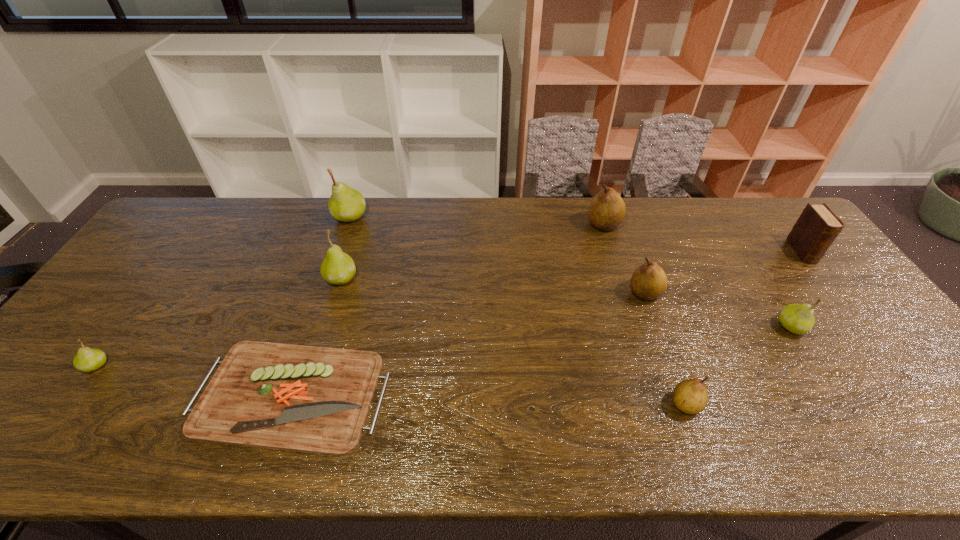
This screenshot has width=960, height=540. Identify the location of free space at the left edge of the desktop. (90, 383).

The height and width of the screenshot is (540, 960). What are the coordinates of `vacant position at the near left corner of the desktop` in the screenshot? It's located at (38, 452).

Find the location of `free region at the far right corner`. free region at the far right corner is located at coordinates 782,222.

Where is `vacant area between the tallest pear and the second farthest green pear`? vacant area between the tallest pear and the second farthest green pear is located at coordinates (346, 247).

You are a GUI agent. You are given a task and a screenshot of the screen. Output one action in this format:
    pyautogui.click(x=<x>, y=<y>)
    Task: Click on the unoccupied position between the second smallest brown pear and the shortest object
    
    Given the screenshot: What is the action you would take?
    pyautogui.click(x=468, y=344)

Where is `empty space that is in between the fifth farthest pear and the smallest green pear`? This screenshot has width=960, height=540. empty space that is in between the fifth farthest pear and the smallest green pear is located at coordinates (444, 346).

Locate an element on the screen. Image resolution: width=960 pixels, height=540 pixels. free spot between the second farthest brown pear and the second biggest green pear is located at coordinates (493, 286).

Locate an element on the screen. This screenshot has width=960, height=540. unoccupied position between the farthest brown pear and the eighth object from left to right is located at coordinates click(x=697, y=276).

Find the location of a particular element. The width and height of the screenshot is (960, 540). free space that is in between the rightmost object and the nearest pear is located at coordinates tap(744, 328).

At what (x,y) coordinates should I click in order to perform the action: click on empty space between the tallest pear and the farthest brown pear. Please return your answer as a coordinate pair (x, y). The width and height of the screenshot is (960, 540). Looking at the image, I should click on (477, 221).